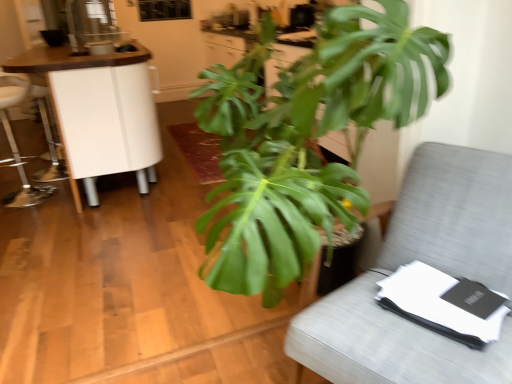
Question: Would you consider gray fabric chair at right to be distant from metallic silver swivel chair at left?

Choices:
 (A) no
 (B) yes

Answer: (B)

Question: From the image's perspective, does gray fabric chair at right appear higher than metallic silver swivel chair at left?

Choices:
 (A) yes
 (B) no

Answer: (B)

Question: Is gray fabric chair at right aimed at metallic silver swivel chair at left?

Choices:
 (A) no
 (B) yes

Answer: (A)

Question: Does gray fabric chair at right appear on the right side of metallic silver swivel chair at left?

Choices:
 (A) yes
 (B) no

Answer: (A)

Question: Is the position of gray fabric chair at right more distant than that of metallic silver swivel chair at left?

Choices:
 (A) no
 (B) yes

Answer: (A)

Question: In terms of width, does green leafy plant at center look wider or thinner when compared to gray fabric chair at right?

Choices:
 (A) wide
 (B) thin

Answer: (A)

Question: Is point (331, 165) positioned closer to the camera than point (452, 251)?

Choices:
 (A) closer
 (B) farther

Answer: (A)

Question: Considering the positions of green leafy plant at center and gray fabric chair at right in the image, is green leafy plant at center bigger or smaller than gray fabric chair at right?

Choices:
 (A) small
 (B) big

Answer: (B)

Question: Do you think green leafy plant at center is within gray fabric chair at right, or outside of it?

Choices:
 (A) outside
 (B) inside

Answer: (A)

Question: In terms of height, does white glossy cabinet at left look taller or shorter compared to metallic silver swivel chair at left?

Choices:
 (A) tall
 (B) short

Answer: (A)

Question: From the image's perspective, relative to metallic silver swivel chair at left, is white glossy cabinet at left above or below?

Choices:
 (A) above
 (B) below

Answer: (A)

Question: From a real-world perspective, is white glossy cabinet at left physically located above or below metallic silver swivel chair at left?

Choices:
 (A) above
 (B) below

Answer: (A)

Question: Would you say white glossy cabinet at left is to the left or to the right of metallic silver swivel chair at left in the picture?

Choices:
 (A) right
 (B) left

Answer: (A)

Question: Considering the positions of gray fabric chair at right and metallic silver swivel chair at left in the image, is gray fabric chair at right taller or shorter than metallic silver swivel chair at left?

Choices:
 (A) tall
 (B) short

Answer: (B)

Question: From the image's perspective, is gray fabric chair at right above or below metallic silver swivel chair at left?

Choices:
 (A) above
 (B) below

Answer: (B)